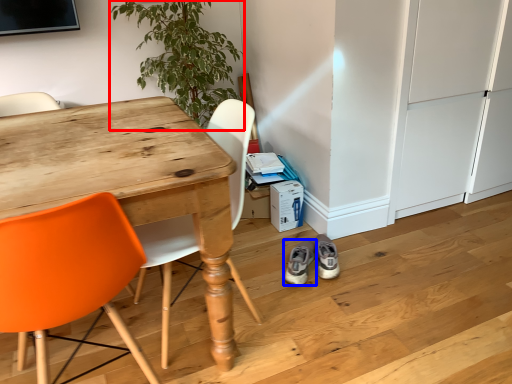
Question: Which object is closer to the camera taking this photo, houseplant (highlighted by a red box) or footwear (highlighted by a blue box)?

Choices:
 (A) houseplant
 (B) footwear

Answer: (B)